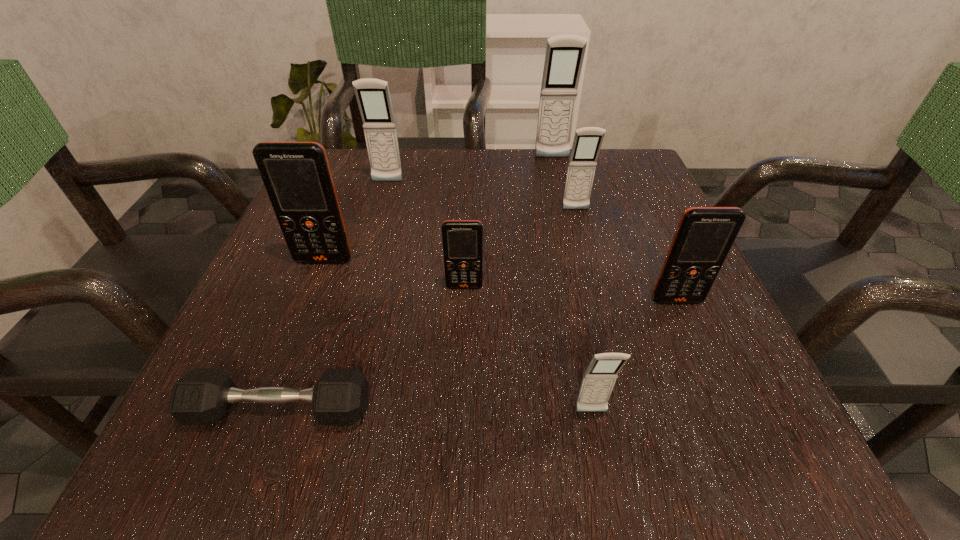
Find the location of `the tallest object`. the tallest object is located at coordinates 564,56.

You are a GUI agent. You are given a task and a screenshot of the screen. Output one action in this format:
    pyautogui.click(x=<x>, y=<y>)
    Task: Click on the biggest gray cellular telephone
    This screenshot has width=960, height=540.
    Given the screenshot: What is the action you would take?
    pyautogui.click(x=564, y=56)

At what (x,y) coordinates should I click in order to perform the action: click on the second farthest gray cellular telephone. Please return your answer as a coordinate pair (x, y). This screenshot has width=960, height=540. Looking at the image, I should click on (373, 97).

This screenshot has height=540, width=960. Identify the location of the seventh nearest object. (373, 97).

Find the location of a particular element. The image size is (960, 540). the farthest orange cellular telephone is located at coordinates (297, 177).

The image size is (960, 540). Find the location of `the fourth farthest object`. the fourth farthest object is located at coordinates (297, 177).

You are a GUI agent. You are given a task and a screenshot of the screen. Output one action in this format:
    pyautogui.click(x=<x>, y=<y>)
    Task: Click on the third farthest object
    The width and height of the screenshot is (960, 540).
    Given the screenshot: What is the action you would take?
    pyautogui.click(x=587, y=142)

Identify the location of the third farthest gray cellular telephone. (587, 142).

Find the location of a particular element. Image resolution: width=960 pixels, height=540 pixels. the rightmost object is located at coordinates (705, 235).

The width and height of the screenshot is (960, 540). I want to click on the sixth farthest cellular telephone, so click(x=705, y=235).